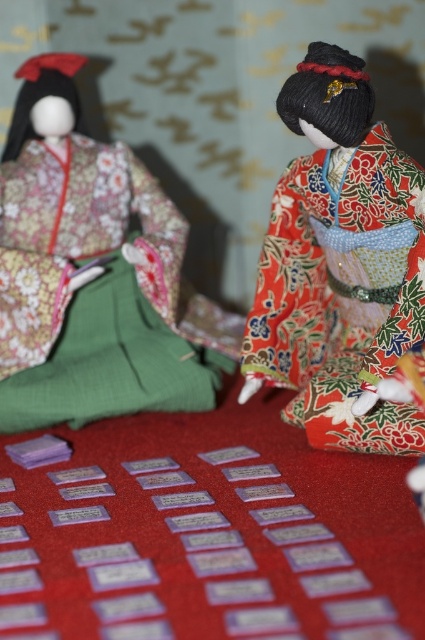
Question: Can you confirm if matte floral kimono at left is positioned above shiny red kimono doll at center?

Choices:
 (A) no
 (B) yes

Answer: (B)

Question: Which point is farther from the camera taking this photo?

Choices:
 (A) (6, 339)
 (B) (382, 337)

Answer: (A)

Question: Can you confirm if matte floral kimono at left is thinner than shiny red kimono doll at center?

Choices:
 (A) yes
 (B) no

Answer: (B)

Question: Which point is farther to the camera?

Choices:
 (A) matte floral kimono at left
 (B) shiny red kimono doll at center

Answer: (A)

Question: Is matte floral kimono at left positioned at the back of shiny red kimono doll at center?

Choices:
 (A) yes
 (B) no

Answer: (A)